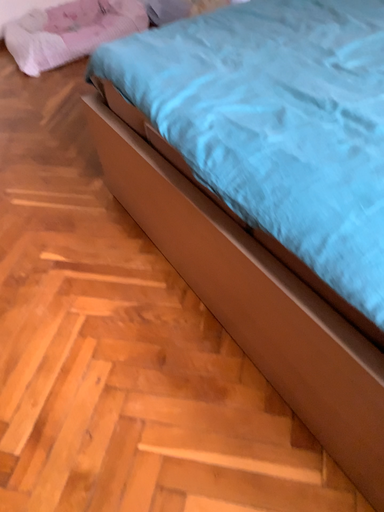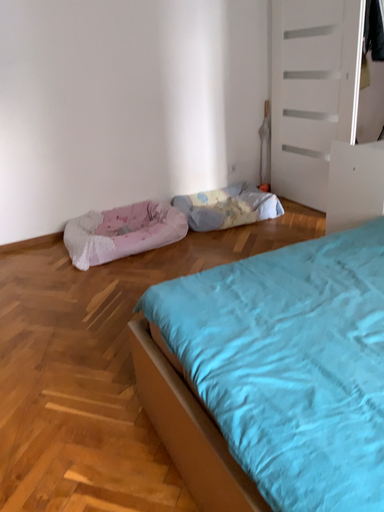
Question: Which way did the camera rotate in the video?

Choices:
 (A) rotated upward
 (B) rotated downward

Answer: (A)